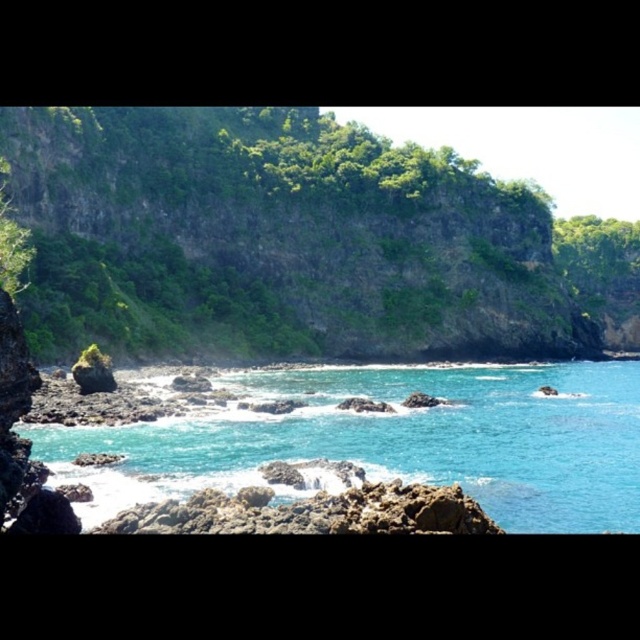
You are a hiker standing at the base of the cliffs near the dark weathered rocks. You want to reach the highest point of the green rocky cliff at upper center marked by point [298,241]. Is there a direct path from your current position to this point?

The green rocky cliff at upper center is represented by point [298,241], so there is no direct path from the base of the cliffs to this point as the cliffs are steep and rugged.

You are a drone operator planning to capture aerial footage of the green rocky cliff at upper center and the turquoise glossy water at center. The drone has a maximum flight range of 30 meters. Can you fly the drone from the cliff to the water without exceeding its range?

The green rocky cliff at upper center and turquoise glossy water at center are 31.06 meters apart from each other, so the drone cannot fly from the cliff to the water without exceeding its 30 meter range.